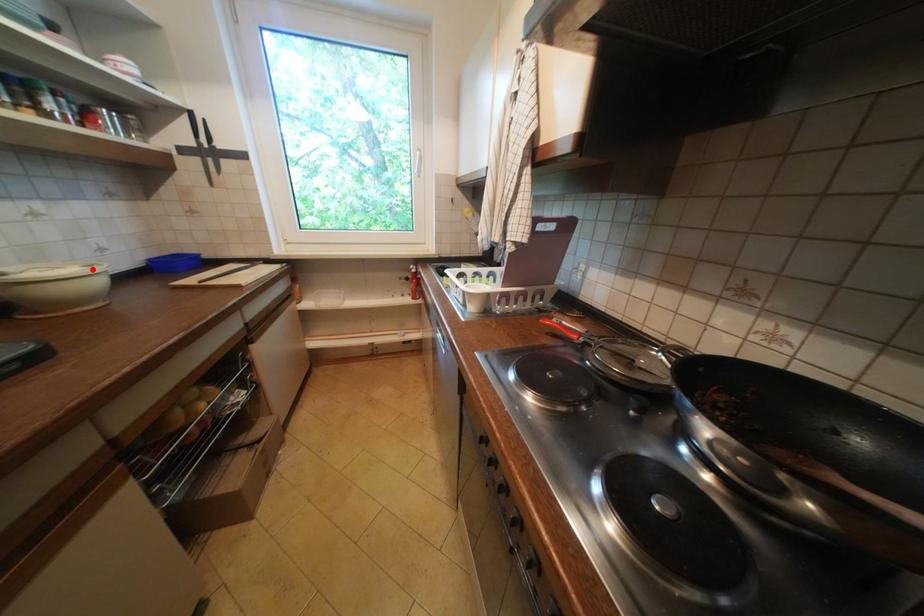
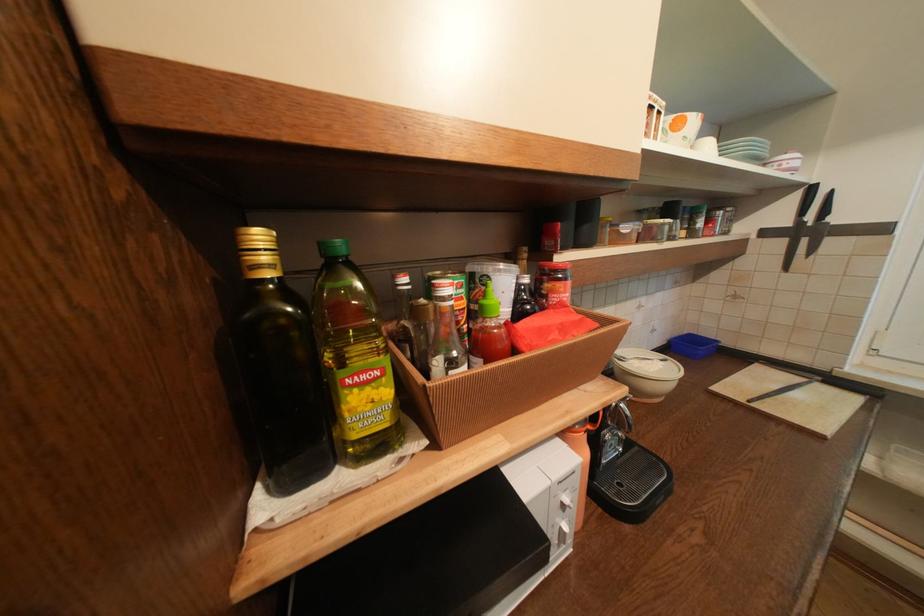
Where in the second image is the point corresponding to the highlighted location from the first image?

(670, 363)